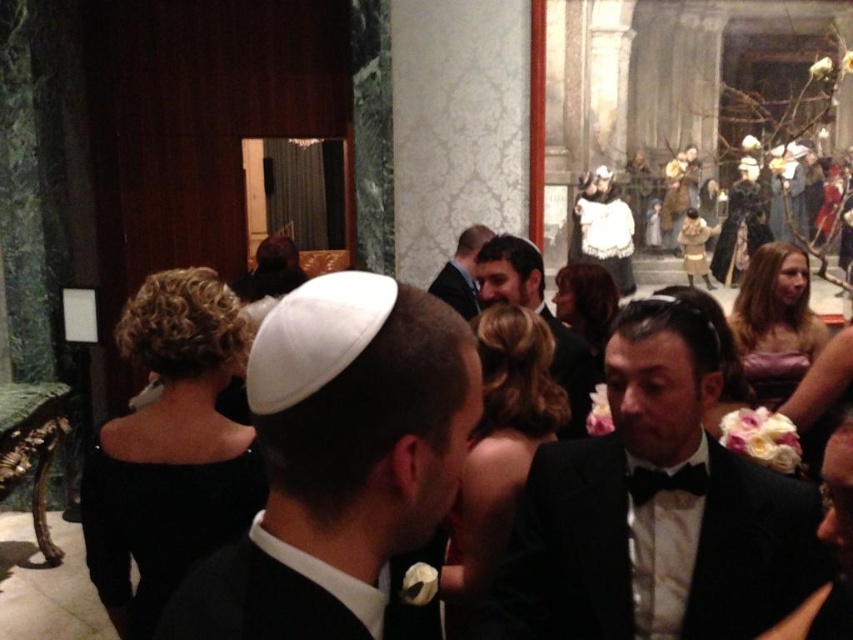
Question: Which point is closer to the camera?

Choices:
 (A) matte black suit at center
 (B) black satin bow tie at lower right
 (C) black velvet dress at center

Answer: (B)

Question: Does white matte kippah at center appear on the left side of black velvet dress at center?

Choices:
 (A) no
 (B) yes

Answer: (A)

Question: Can you confirm if black satin tuxedo at center is wider than white satin kippah at center?

Choices:
 (A) no
 (B) yes

Answer: (A)

Question: Can you confirm if white matte kippah at center is positioned below white satin kippah at center?

Choices:
 (A) yes
 (B) no

Answer: (B)

Question: Based on their relative distances, which object is farther from the white satin kippah at center?

Choices:
 (A) black satin bow tie at lower right
 (B) white matte kippah at center
 (C) matte black suit at center

Answer: (C)

Question: Which object is the closest to the black satin tuxedo at center?

Choices:
 (A) black velvet dress at center
 (B) white matte kippah at center
 (C) white satin kippah at center
 (D) black satin bow tie at lower right

Answer: (C)